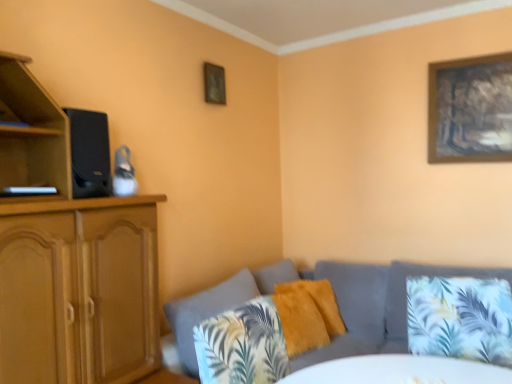
Question: Does fuzzy yellow pillow at center, which is the first pillow in back-to-front order, appear on the right side of wooden picture frame at upper center, placed as the second picture frame when sorted from right to left?

Choices:
 (A) yes
 (B) no

Answer: (A)

Question: From the image's perspective, is fuzzy yellow pillow at center, which ranks as the 3th pillow in front-to-back order, under wooden picture frame at upper center, placed as the second picture frame when sorted from right to left?

Choices:
 (A) no
 (B) yes

Answer: (B)

Question: Is fuzzy yellow pillow at center, which ranks as the 3th pillow in front-to-back order, touching wooden picture frame at upper center, placed as the second picture frame when sorted from right to left?

Choices:
 (A) yes
 (B) no

Answer: (B)

Question: Is fuzzy yellow pillow at center, which ranks as the 3th pillow in front-to-back order, positioned far away from wooden picture frame at upper center, placed as the second picture frame when sorted from right to left?

Choices:
 (A) no
 (B) yes

Answer: (B)

Question: Does fuzzy yellow pillow at center, which is the first pillow in back-to-front order, turn towards wooden picture frame at upper center, the first picture frame when ordered from left to right?

Choices:
 (A) no
 (B) yes

Answer: (A)

Question: Choose the correct answer: Is wooden framed artwork at upper right, which is the 1th picture frame in right-to-left order, inside black matte speaker at left or outside it?

Choices:
 (A) inside
 (B) outside

Answer: (B)

Question: Is wooden framed artwork at upper right, arranged as the second picture frame when viewed from the left, to the left or to the right of black matte speaker at left in the image?

Choices:
 (A) right
 (B) left

Answer: (A)

Question: Considering the positions of wooden framed artwork at upper right, arranged as the second picture frame when viewed from the left, and black matte speaker at left in the image, is wooden framed artwork at upper right, arranged as the second picture frame when viewed from the left, bigger or smaller than black matte speaker at left?

Choices:
 (A) small
 (B) big

Answer: (B)

Question: Is wooden framed artwork at upper right, arranged as the second picture frame when viewed from the left, wider or thinner than black matte speaker at left?

Choices:
 (A) thin
 (B) wide

Answer: (A)

Question: From the image's perspective, is wooden framed artwork at upper right, arranged as the second picture frame when viewed from the left, positioned above or below wooden picture frame at upper center, the first picture frame when ordered from left to right?

Choices:
 (A) above
 (B) below

Answer: (B)

Question: In terms of size, does wooden framed artwork at upper right, which is the 1th picture frame in right-to-left order, appear bigger or smaller than wooden picture frame at upper center, the first picture frame when ordered from left to right?

Choices:
 (A) small
 (B) big

Answer: (B)

Question: Choose the correct answer: Is wooden framed artwork at upper right, arranged as the second picture frame when viewed from the left, inside wooden picture frame at upper center, the first picture frame when ordered from left to right, or outside it?

Choices:
 (A) outside
 (B) inside

Answer: (A)

Question: Does point (436, 137) appear closer or farther from the camera than point (210, 71)?

Choices:
 (A) closer
 (B) farther

Answer: (B)

Question: Is point (194, 354) positioned closer to the camera than point (342, 327)?

Choices:
 (A) farther
 (B) closer

Answer: (B)

Question: Which is correct: textured gray couch at lower right is inside fuzzy yellow pillow at center, which ranks as the 3th pillow in front-to-back order, or outside of it?

Choices:
 (A) outside
 (B) inside

Answer: (A)